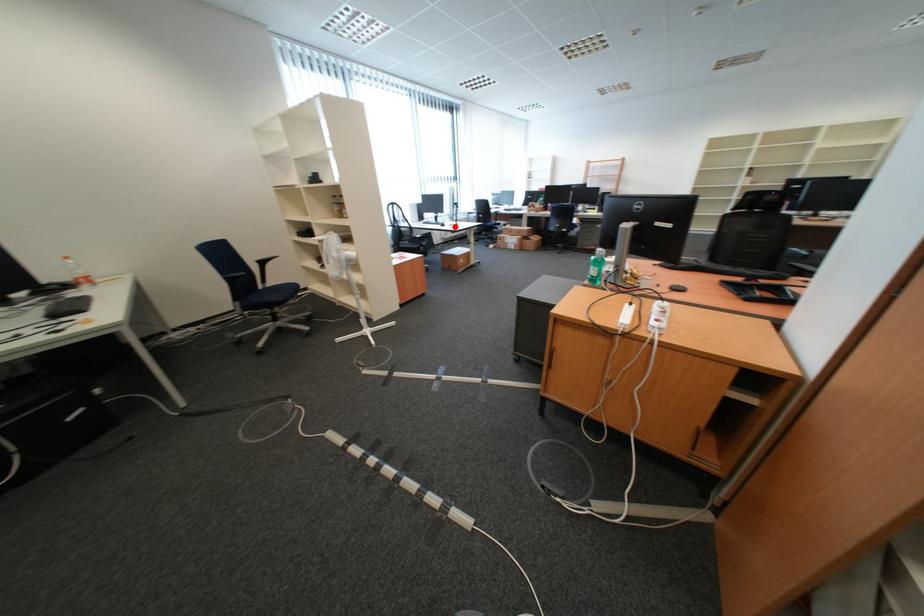
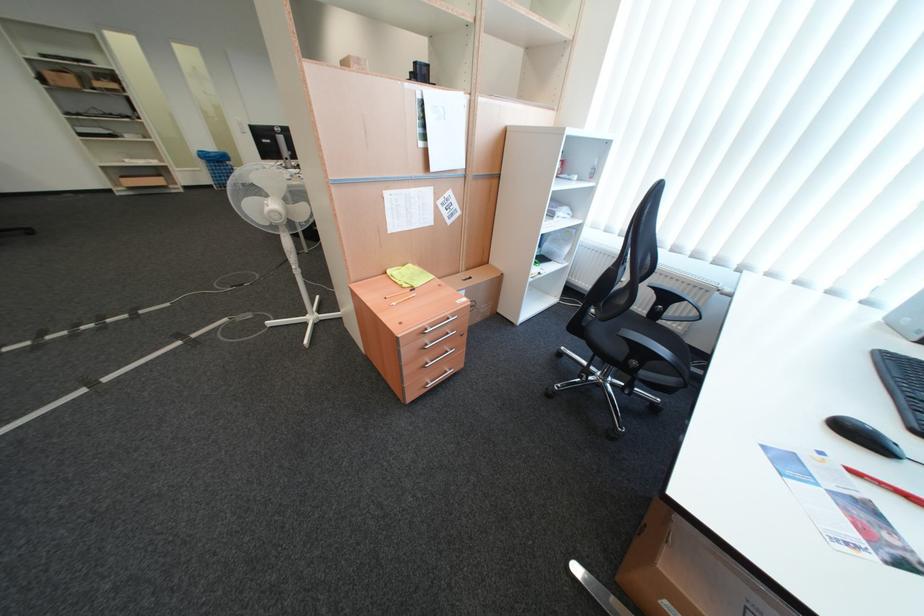
Locate, in the second image, the point that corresponds to the highlighted location in the first image.

(864, 434)